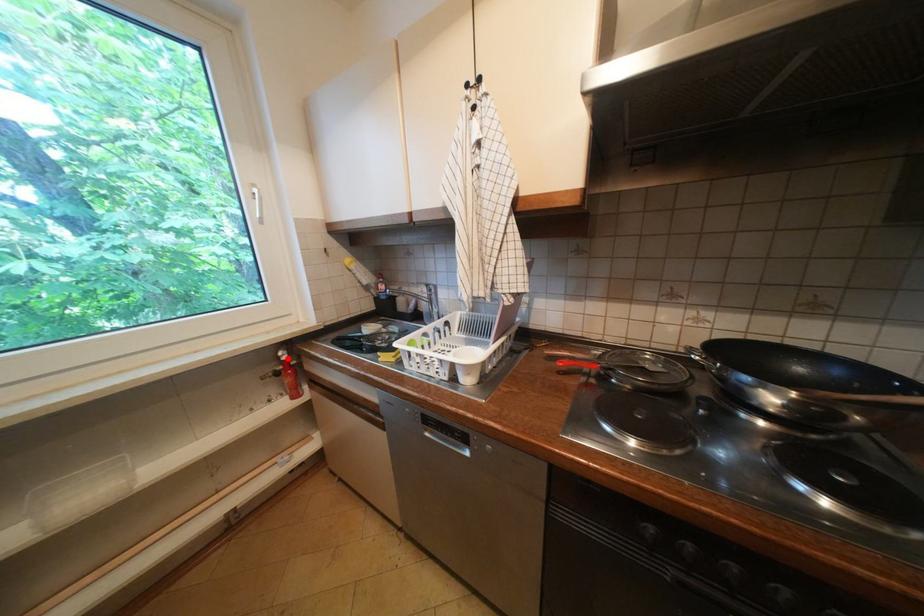
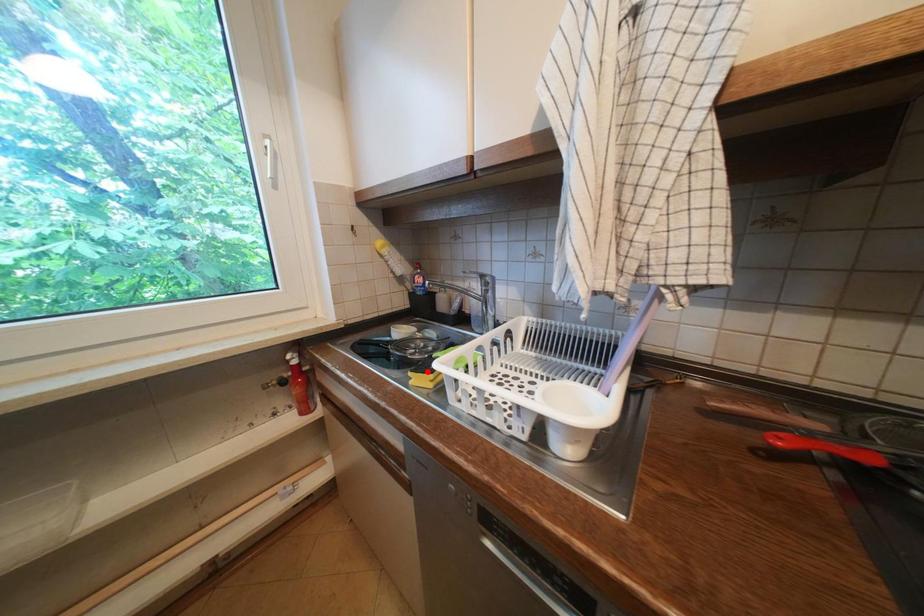
I am providing you with two images of the same scene from different viewpoints. A red point is marked on the first image and another point is marked on the second image. Do the highlighted points in image1 and image2 indicate the same real-world spot?

No